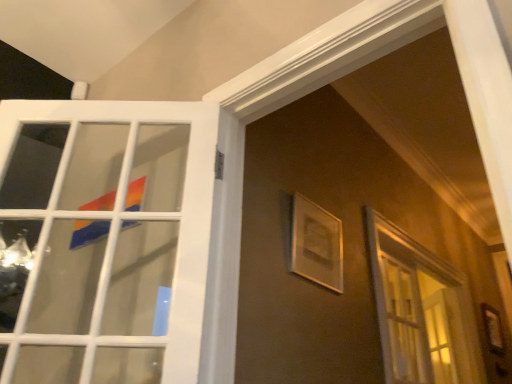
In order to face matte white picture frame at upper center, should I rotate leftwards or rightwards?

To align with it, rotate right about 8.654°.

Find the location of a particular element. matte white picture frame at upper center is located at coordinates (316, 244).

The height and width of the screenshot is (384, 512). What do you see at coordinates (316, 244) in the screenshot?
I see `matte white picture frame at upper center` at bounding box center [316, 244].

Describe the element at coordinates (104, 239) in the screenshot. The width and height of the screenshot is (512, 384). I see `white glossy door at upper left` at that location.

Looking at this image, what is the approximate height of white glossy door at upper left?

91.26 centimeters.

You are a GUI agent. You are given a task and a screenshot of the screen. Output one action in this format:
    pyautogui.click(x=<x>, y=<y>)
    Task: Click on the white glossy door at upper left
    The image size is (512, 384).
    Given the screenshot: What is the action you would take?
    pyautogui.click(x=104, y=239)

In order to click on matte white picture frame at upper center in this screenshot , I will do `click(316, 244)`.

Which object is positioned more to the left, matte white picture frame at upper center or white glossy door at upper left?

white glossy door at upper left.

In the image, is matte white picture frame at upper center positioned in front of or behind white glossy door at upper left?

matte white picture frame at upper center is positioned farther from the viewer than white glossy door at upper left.

Does point (293, 215) come farther from viewer compared to point (178, 349)?

Yes, it is behind point (178, 349).

From the image's perspective, is matte white picture frame at upper center located beneath white glossy door at upper left?

Yes, from the image's perspective, matte white picture frame at upper center is beneath white glossy door at upper left.

From a real-world perspective, which object rests below the other?

white glossy door at upper left, from a real-world perspective.

Between matte white picture frame at upper center and white glossy door at upper left, which one has larger width?

white glossy door at upper left is wider.

Can you confirm if matte white picture frame at upper center is taller than white glossy door at upper left?

No.

Consider the image. Is matte white picture frame at upper center bigger than white glossy door at upper left?

Incorrect, matte white picture frame at upper center is not larger than white glossy door at upper left.

Is matte white picture frame at upper center inside the boundaries of white glossy door at upper left, or outside?

matte white picture frame at upper center cannot be found inside white glossy door at upper left.

Can you see matte white picture frame at upper center touching white glossy door at upper left?

There is a gap between matte white picture frame at upper center and white glossy door at upper left.

From the picture: Is matte white picture frame at upper center turned away from white glossy door at upper left?

No, matte white picture frame at upper center is not facing the opposite direction of white glossy door at upper left.

In order to click on door in front of the matte white picture frame at upper center in this screenshot , I will do `click(104, 239)`.

Would you say white glossy door at upper left is to the left or to the right of matte white picture frame at upper center in the picture?

From the image, it's evident that white glossy door at upper left is to the left of matte white picture frame at upper center.

Is white glossy door at upper left closer to the viewer compared to matte white picture frame at upper center?

Yes, the depth of white glossy door at upper left is less than that of matte white picture frame at upper center.

Considering the points (201, 293) and (291, 270), which point is in front, point (201, 293) or point (291, 270)?

Positioned in front is point (201, 293).

From the image's perspective, is white glossy door at upper left below matte white picture frame at upper center?

No, from the image's perspective, white glossy door at upper left is not beneath matte white picture frame at upper center.

From a real-world perspective, relative to matte white picture frame at upper center, is white glossy door at upper left vertically above or below?

white glossy door at upper left is below matte white picture frame at upper center.

Considering the sizes of objects white glossy door at upper left and matte white picture frame at upper center in the image provided, who is wider, white glossy door at upper left or matte white picture frame at upper center?

white glossy door at upper left is wider.

Consider the image. Which of these two, white glossy door at upper left or matte white picture frame at upper center, stands shorter?

Standing shorter between the two is matte white picture frame at upper center.

Considering the sizes of white glossy door at upper left and matte white picture frame at upper center in the image, is white glossy door at upper left bigger or smaller than matte white picture frame at upper center?

In the image, white glossy door at upper left appears to be larger than matte white picture frame at upper center.

Which is correct: white glossy door at upper left is inside matte white picture frame at upper center, or outside of it?

white glossy door at upper left is not enclosed by matte white picture frame at upper center.

Can you see white glossy door at upper left touching matte white picture frame at upper center?

No, white glossy door at upper left is not making contact with matte white picture frame at upper center.

Is white glossy door at upper left oriented away from matte white picture frame at upper center?

That's not correct — white glossy door at upper left is not looking away from matte white picture frame at upper center.

What's the angular difference between white glossy door at upper left and matte white picture frame at upper center's facing directions?

They differ by 47.2 degrees in their facing directions.

Find the location of `picture frame that is on the right side of white glossy door at upper left`. picture frame that is on the right side of white glossy door at upper left is located at coordinates (316, 244).

Locate an element on the screen. This screenshot has height=384, width=512. picture frame located above the white glossy door at upper left (from a real-world perspective) is located at coordinates (316, 244).

Where is `door below the matte white picture frame at upper center (from a real-world perspective)`? door below the matte white picture frame at upper center (from a real-world perspective) is located at coordinates 104,239.